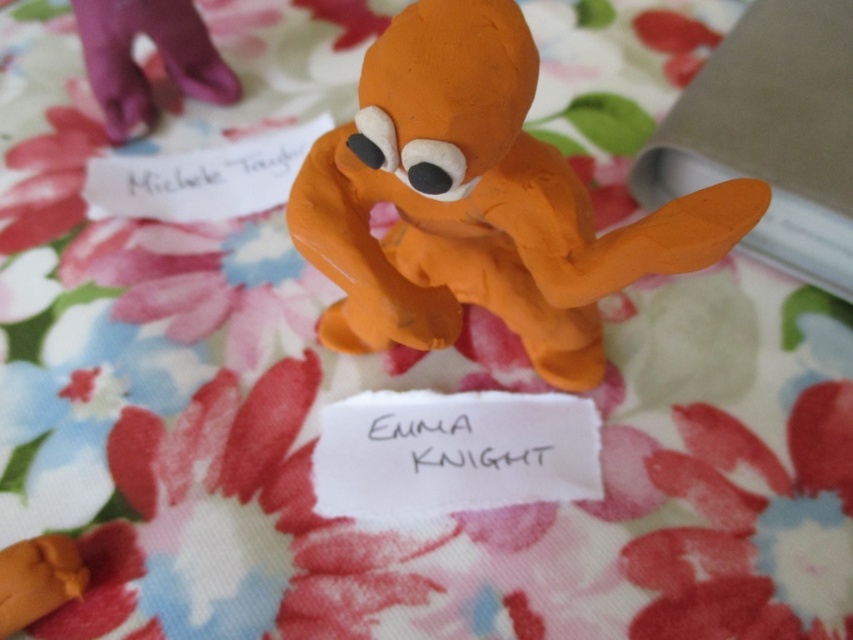
Question: Estimate the real-world distances between objects in this image. Which object is closer to the orange clay dog at center?

Choices:
 (A) matte white paper at upper left
 (B) black paper at center

Answer: (B)

Question: Can you confirm if black paper at center is wider than matte white paper at upper left?

Choices:
 (A) yes
 (B) no

Answer: (B)

Question: Considering the real-world distances, which object is farthest from the black paper at center?

Choices:
 (A) matte white paper at upper left
 (B) orange clay dog at center

Answer: (A)

Question: Which object is the farthest from the matte white paper at upper left?

Choices:
 (A) black paper at center
 (B) orange clay dog at center

Answer: (A)

Question: Does orange clay dog at center come behind matte white paper at upper left?

Choices:
 (A) yes
 (B) no

Answer: (B)

Question: Is black paper at center positioned at the back of matte white paper at upper left?

Choices:
 (A) no
 (B) yes

Answer: (A)